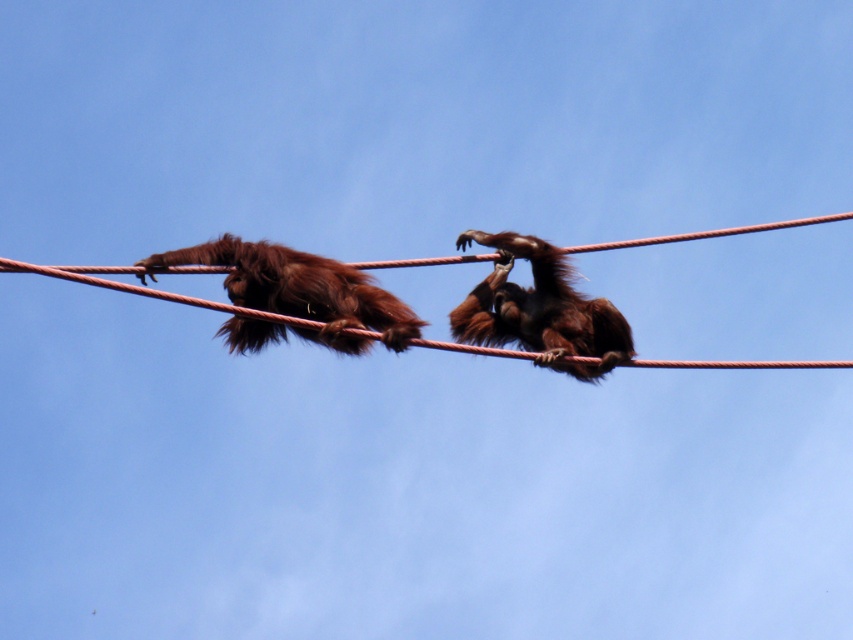
You are a zookeeper observing two brown furry monkeys hanging from parallel red ropes. You need to determine if the brown furry monkey at upper left has a larger width than the brown furry monkey at center. Based on the ropes they are hanging from, can you infer which monkey is wider?

The brown furry monkey at upper left might be wider than brown furry monkey at center according to the description.

You are a zookeeper observing two brown furry monkeys hanging from parallel red ropes. You need to determine their positions relative to each other. Which monkey is closer to you, the brown furry monkey at upper left or the brown furry monkey at center?

The brown furry monkey at upper left is closer to you because it is positioned in front of the brown furry monkey at center.